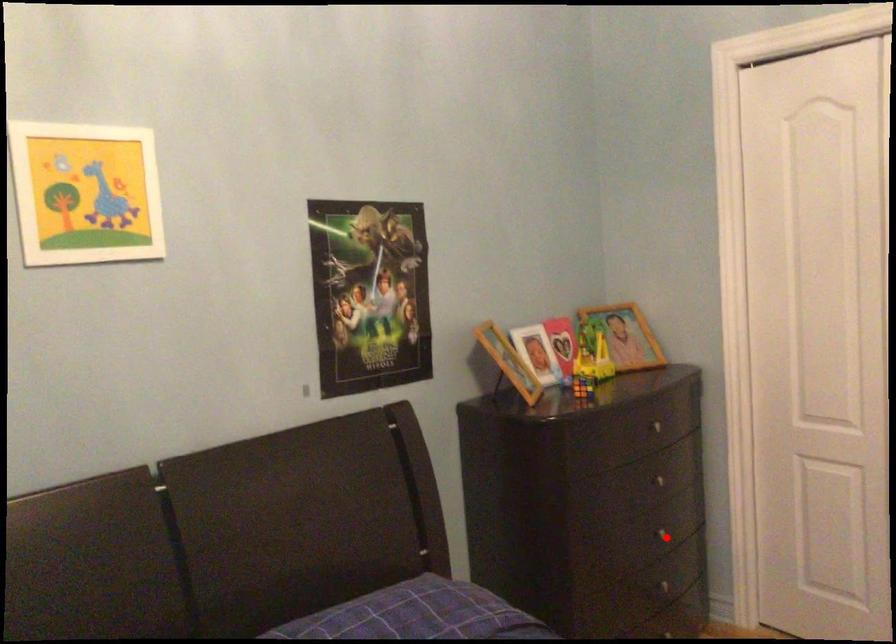
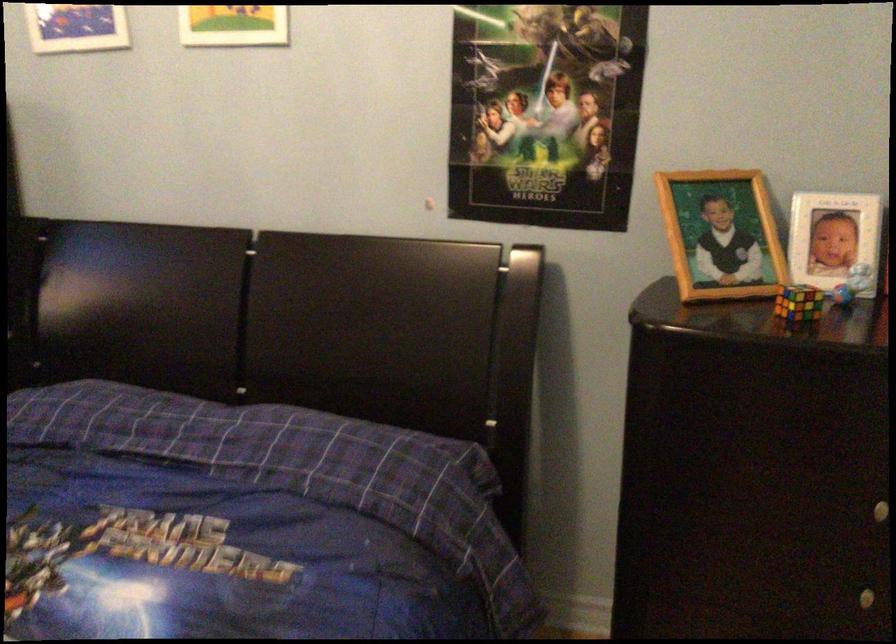
Question: I am providing you with two images of the same scene from different viewpoints. In image1, a red point is highlighted. Considering the same 3D point in image2, which of the following is correct?

Choices:
 (A) It is closer
 (B) It is farther

Answer: (A)